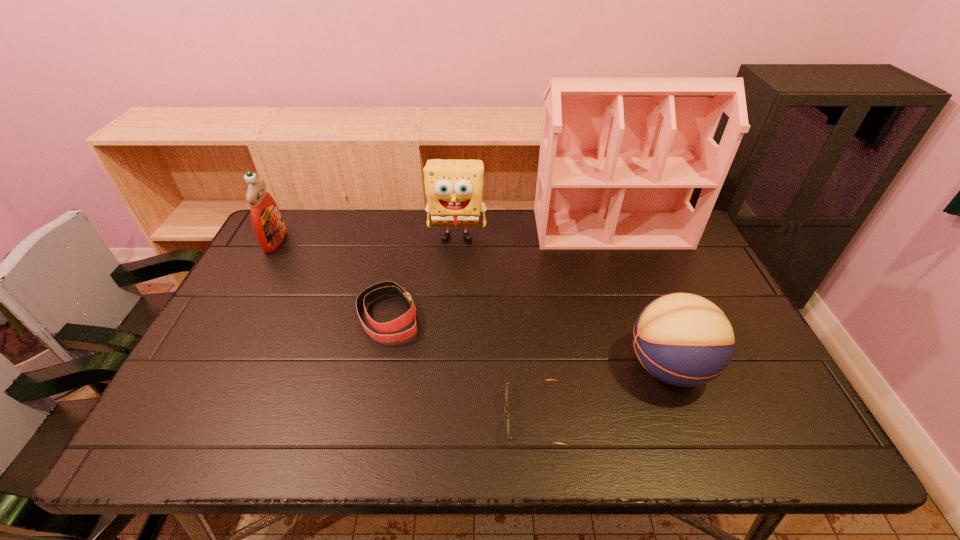
Identify the location of object that is at the left edge. This screenshot has width=960, height=540. (267, 221).

What are the coordinates of `dollhouse that is at the right edge` in the screenshot? It's located at (619, 159).

Find the location of `basketball that is at the right edge`. basketball that is at the right edge is located at coordinates (682, 339).

This screenshot has width=960, height=540. I want to click on object present at the far left corner, so click(x=267, y=221).

The image size is (960, 540). I want to click on object situated at the far right corner, so (x=619, y=159).

Locate an element on the screen. The image size is (960, 540). free region at the far edge of the desktop is located at coordinates (330, 237).

Image resolution: width=960 pixels, height=540 pixels. In the image, there is a desktop. Find the location of `vacant space at the near edge`. vacant space at the near edge is located at coordinates (256, 451).

The height and width of the screenshot is (540, 960). In the image, there is a desktop. What are the coordinates of `vacant area at the left edge` in the screenshot? It's located at (225, 327).

This screenshot has width=960, height=540. I want to click on vacant position at the right edge of the desktop, so pos(679,293).

The image size is (960, 540). In the image, there is a desktop. In order to click on vacant space at the far left corner in this screenshot , I will do `click(311, 250)`.